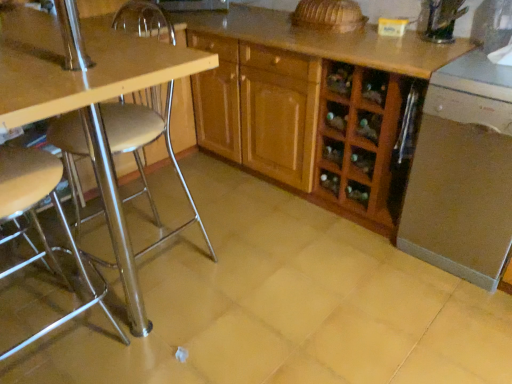
At what (x,y) coordinates should I click in order to perform the action: click on vacant area on the back side of metallic silver stool at left. Please return your answer as a coordinate pair (x, y). Looking at the image, I should click on (54, 273).